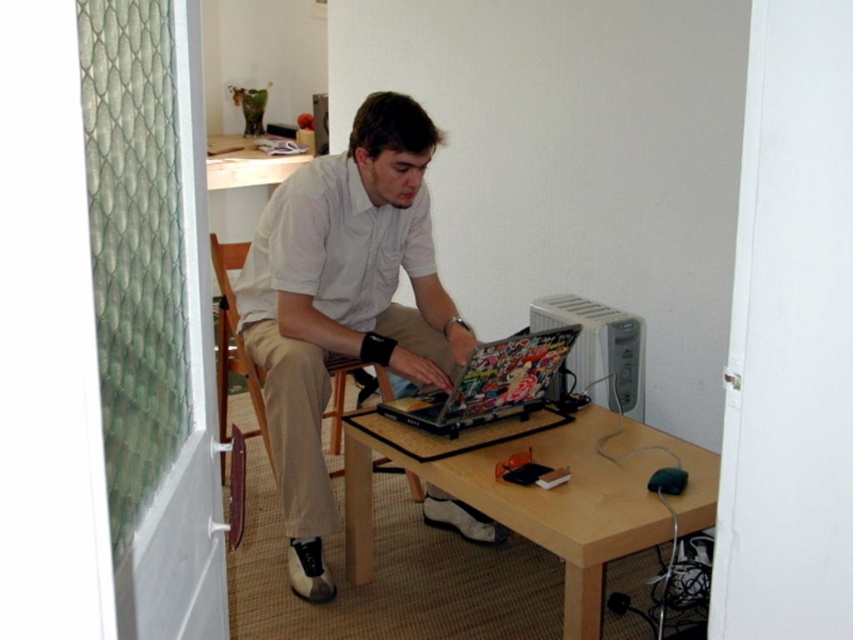
You are a tailor who needs to create a custom garment for the man in the image. Given the light beige cotton shirt at center and the wooden chair at center, which item has a larger width?

The wooden chair at center has a larger width than the light beige cotton shirt at center.

You are standing in the room and want to place a 10 cm tall statue on the table. Considering the height difference between the light beige cotton shirt at center and the light brown wood table at center, will the statue be visible over the shirt?

The light beige cotton shirt at center is taller than the light brown wood table at center. Therefore, placing a 10 cm tall statue on the table would not make it visible over the shirt since the shirt is taller than the table itself.